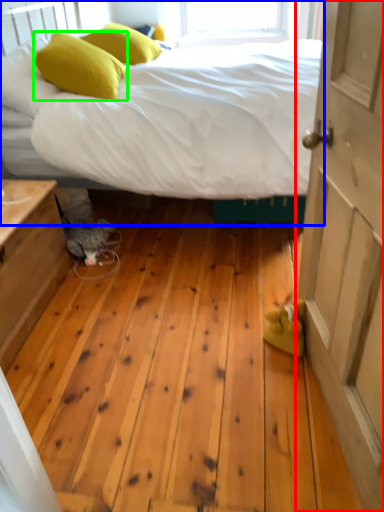
Question: Which object is positioned farthest from door (highlighted by a red box)? Select from bed (highlighted by a blue box) and pillow (highlighted by a green box).

Choices:
 (A) bed
 (B) pillow

Answer: (B)